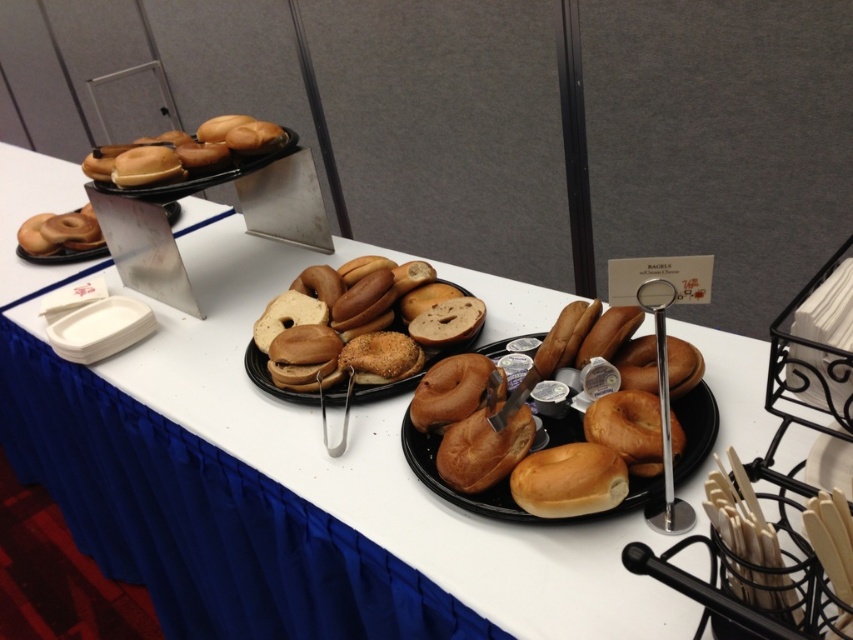
Is brown matte bagels at center above matte black bagel at upper left?

Incorrect, brown matte bagels at center is not positioned above matte black bagel at upper left.

Which is above, brown matte bagels at center or matte black bagel at upper left?

matte black bagel at upper left is above.

Is point (426, 352) more distant than point (178, 212)?

That is False.

I want to click on brown matte bagels at center, so click(415, 372).

Who is taller, golden brown bagels at center or brown matte bagels at center?

golden brown bagels at center

Is golden brown bagels at center below brown matte bagels at center?

Yes.

Describe the element at coordinates (503, 483) in the screenshot. I see `golden brown bagels at center` at that location.

Find the location of a particular element. The image size is (853, 640). golden brown bagels at center is located at coordinates [x=503, y=483].

How distant is golden brown bagels at center from matte black bagel at upper left?

A distance of 4.60 feet exists between golden brown bagels at center and matte black bagel at upper left.

Does golden brown bagels at center appear on the right side of matte black bagel at upper left?

Correct, you'll find golden brown bagels at center to the right of matte black bagel at upper left.

Between point (648, 484) and point (170, 211), which one is positioned behind?

Point (170, 211)

The width and height of the screenshot is (853, 640). In order to click on golden brown bagels at center in this screenshot , I will do `click(503, 483)`.